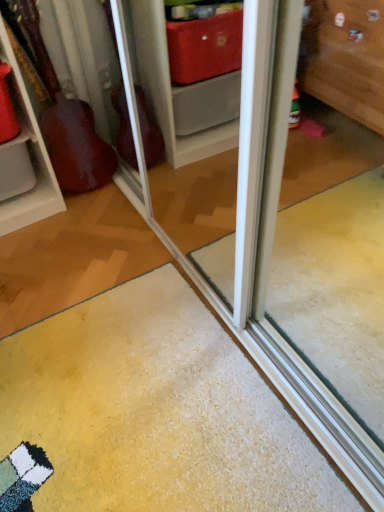
Question: From the image's perspective, does yellow carpet at lower center appear lower than wooden guitar at left?

Choices:
 (A) yes
 (B) no

Answer: (A)

Question: Is yellow carpet at lower center at the left side of wooden guitar at left?

Choices:
 (A) yes
 (B) no

Answer: (B)

Question: Does yellow carpet at lower center have a lesser width compared to wooden guitar at left?

Choices:
 (A) yes
 (B) no

Answer: (B)

Question: From a real-world perspective, is yellow carpet at lower center physically below wooden guitar at left?

Choices:
 (A) no
 (B) yes

Answer: (B)

Question: Does yellow carpet at lower center turn towards wooden guitar at left?

Choices:
 (A) no
 (B) yes

Answer: (A)

Question: Does yellow carpet at lower center have a larger size compared to wooden guitar at left?

Choices:
 (A) no
 (B) yes

Answer: (B)

Question: Does wooden guitar at left lie in front of yellow carpet at lower center?

Choices:
 (A) yes
 (B) no

Answer: (B)

Question: Does wooden guitar at left have a lesser width compared to yellow carpet at lower center?

Choices:
 (A) no
 (B) yes

Answer: (B)

Question: Are wooden guitar at left and yellow carpet at lower center beside each other?

Choices:
 (A) no
 (B) yes

Answer: (A)

Question: Considering the relative positions of wooden guitar at left and yellow carpet at lower center in the image provided, is wooden guitar at left to the right of yellow carpet at lower center from the viewer's perspective?

Choices:
 (A) yes
 (B) no

Answer: (B)

Question: Considering the relative sizes of wooden guitar at left and yellow carpet at lower center in the image provided, is wooden guitar at left shorter than yellow carpet at lower center?

Choices:
 (A) no
 (B) yes

Answer: (A)

Question: Considering the relative sizes of wooden guitar at left and yellow carpet at lower center in the image provided, is wooden guitar at left bigger than yellow carpet at lower center?

Choices:
 (A) no
 (B) yes

Answer: (A)

Question: Considering the positions of yellow carpet at lower center and wooden guitar at left in the image, is yellow carpet at lower center wider or thinner than wooden guitar at left?

Choices:
 (A) wide
 (B) thin

Answer: (A)